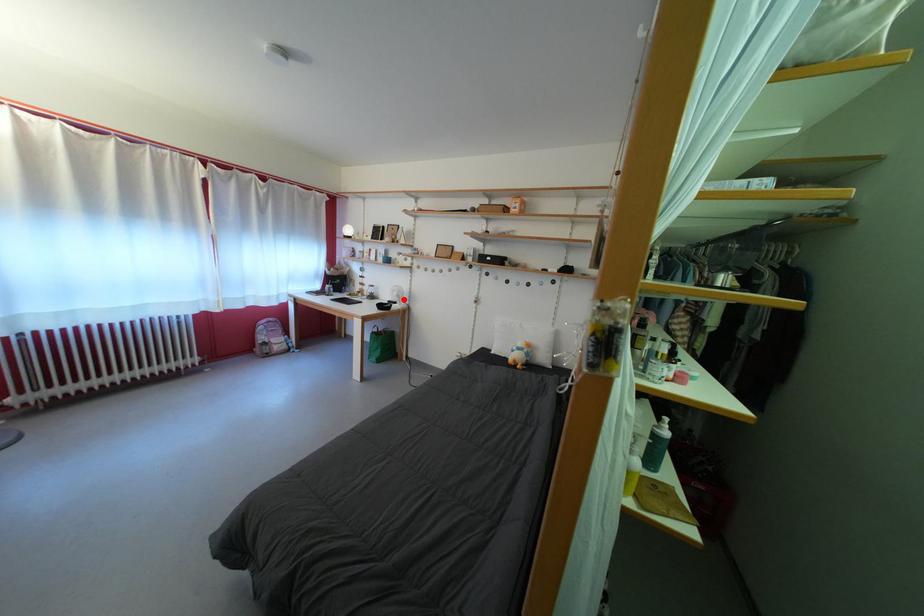
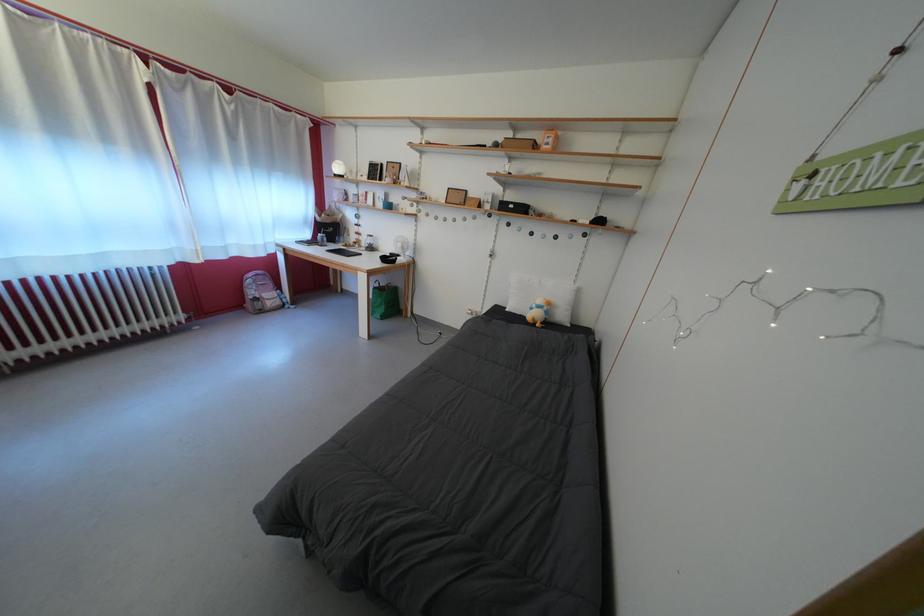
The point at the highlighted location is marked in the first image. Where is the corresponding point in the second image?

(407, 251)